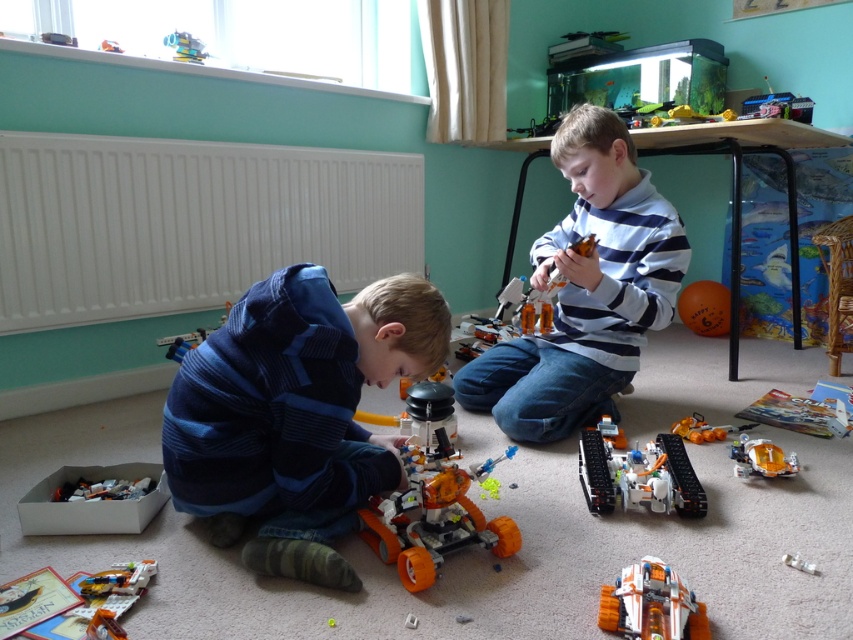
Who is shorter, orange matte toy car at center or translucent orange plastic pieces at lower left?

With less height is translucent orange plastic pieces at lower left.

Is orange matte toy car at center below translucent orange plastic pieces at lower left?

Incorrect, orange matte toy car at center is not positioned below translucent orange plastic pieces at lower left.

Which is behind, point (610, 472) or point (86, 481)?

The point (610, 472) is behind.

At what (x,y) coordinates should I click in order to perform the action: click on orange matte toy car at center. Please return your answer as a coordinate pair (x, y). This screenshot has height=640, width=853. Looking at the image, I should click on (639, 476).

Consider the image. Which is more to the right, orange matte/soft plastic toy at center or orange matte car at lower right?

From the viewer's perspective, orange matte car at lower right appears more on the right side.

Between orange matte/soft plastic toy at center and orange matte car at lower right, which one has less height?

Standing shorter between the two is orange matte car at lower right.

The height and width of the screenshot is (640, 853). What do you see at coordinates (651, 604) in the screenshot?
I see `orange matte/soft plastic toy at center` at bounding box center [651, 604].

Find the location of `orange matte/soft plastic toy at center`. orange matte/soft plastic toy at center is located at coordinates click(651, 604).

Does blue striped sweater at lower left have a greater width compared to striped sweater at center?

No.

Is blue striped sweater at lower left behind striped sweater at center?

No, blue striped sweater at lower left is in front of striped sweater at center.

Image resolution: width=853 pixels, height=640 pixels. Find the location of `blue striped sweater at lower left`. blue striped sweater at lower left is located at coordinates (294, 416).